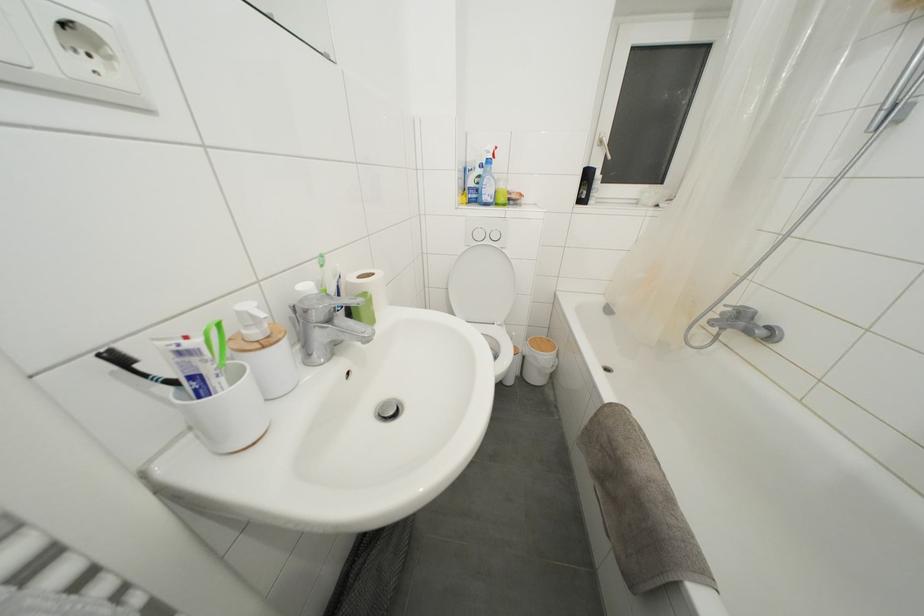
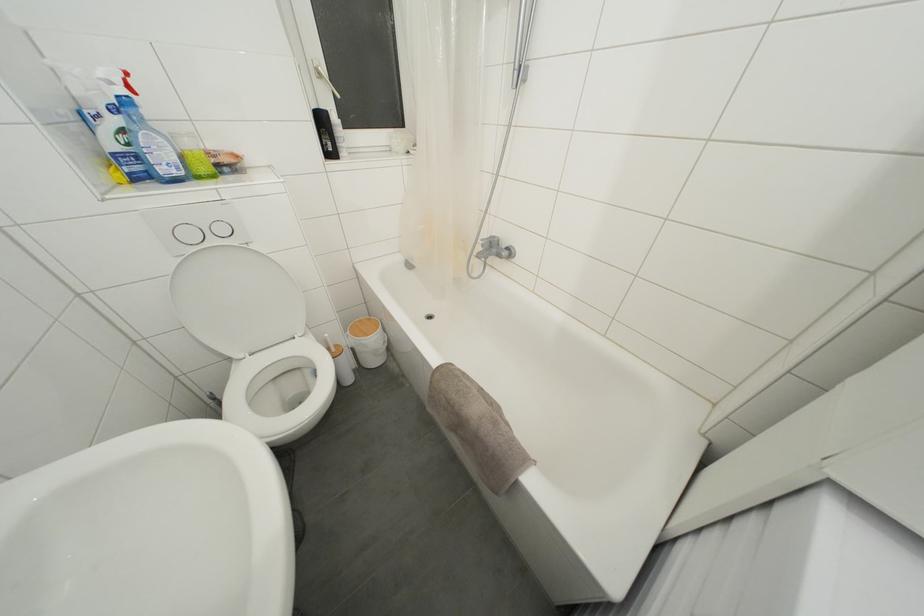
In the second image, find the point that corresponds to the point at 591,180 in the first image.

(325, 126)